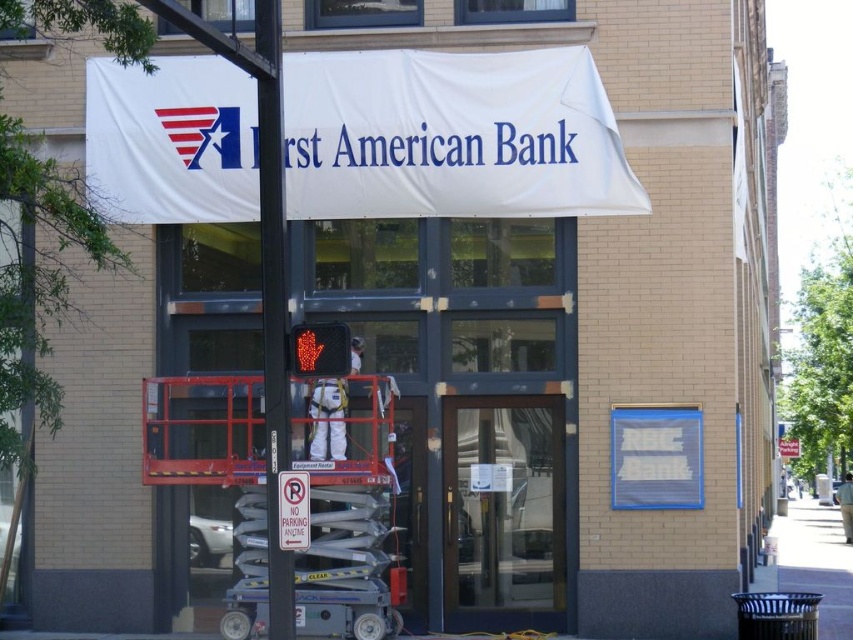
Question: Can you confirm if clear glass door at center is positioned below white paper sign at lower center?

Choices:
 (A) yes
 (B) no

Answer: (B)

Question: From the image, what is the correct spatial relationship of white fabric banner at upper center in relation to white paper sign at lower center?

Choices:
 (A) above
 (B) below

Answer: (A)

Question: Which point is closer to the camera?

Choices:
 (A) white fabric banner at upper center
 (B) white paper sign at lower center

Answer: (B)

Question: Does clear glass door at center have a smaller size compared to white paper sign at lower center?

Choices:
 (A) no
 (B) yes

Answer: (A)

Question: Which of the following is the farthest from the observer?

Choices:
 (A) clear glass door at center
 (B) metallic pole at center
 (C) transparent glass door at center

Answer: (C)

Question: Which object is the closest to the white paper sign at lower center?

Choices:
 (A) transparent glass door at center
 (B) white fabric banner at upper center

Answer: (B)